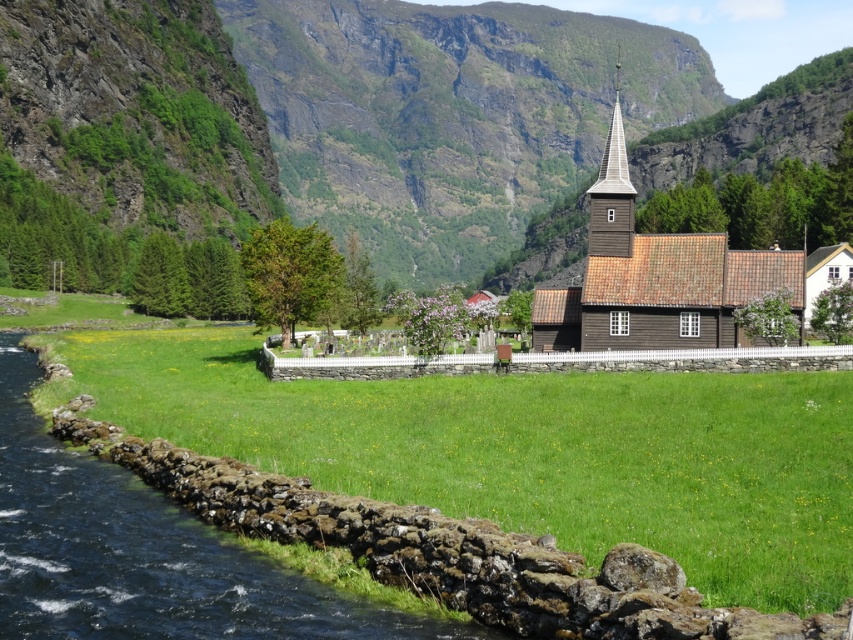
Can you confirm if green grass at center is smaller than brown wooden spire at upper center?

Indeed, green grass at center has a smaller size compared to brown wooden spire at upper center.

Does green grass at center have a larger size compared to brown wooden spire at upper center?

No, green grass at center is not bigger than brown wooden spire at upper center.

At what (x,y) coordinates should I click in order to perform the action: click on green grass at center. Please return your answer as a coordinate pair (x, y). Image resolution: width=853 pixels, height=640 pixels. Looking at the image, I should click on (x=524, y=451).

Does green grassy field at lower center have a larger size compared to brown wooden spire at upper center?

Indeed, green grassy field at lower center has a larger size compared to brown wooden spire at upper center.

Who is lower down, green grassy field at lower center or brown wooden spire at upper center?

brown wooden spire at upper center

Is point (247, 17) closer to camera compared to point (624, 232)?

No.

At what (x,y) coordinates should I click in order to perform the action: click on green grassy field at lower center. Please return your answer as a coordinate pair (x, y). The height and width of the screenshot is (640, 853). Looking at the image, I should click on (364, 115).

Does point (637, 388) come in front of point (718, 337)?

Yes, point (637, 388) is closer to viewer.

Between green grass at center and brown wooden church at center, which one has more height?

Standing taller between the two is brown wooden church at center.

Is point (750, 396) closer to viewer compared to point (751, 282)?

That is True.

At what (x,y) coordinates should I click in order to perform the action: click on green grass at center. Please return your answer as a coordinate pair (x, y). Image resolution: width=853 pixels, height=640 pixels. Looking at the image, I should click on (524, 451).